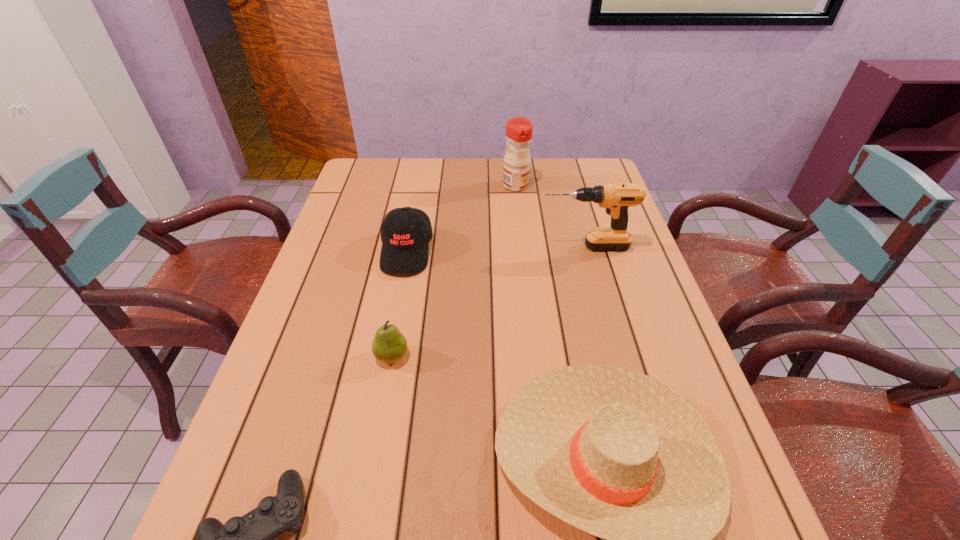
The image size is (960, 540). I want to click on the farthest object, so click(516, 169).

Find the location of `drill`. drill is located at coordinates (616, 198).

Find the location of `baseball cap`. baseball cap is located at coordinates (406, 232).

You are a GUI agent. You are given a task and a screenshot of the screen. Output one action in this format:
    pyautogui.click(x=<x>, y=<y>)
    Task: Click on the fourth farthest object
    The image size is (960, 540).
    Given the screenshot: What is the action you would take?
    [389, 345]

Find the location of a particular element. free space located on the right of the condiment is located at coordinates (577, 186).

Where is `free space located 0.090m at the tip of the drill`? Image resolution: width=960 pixels, height=540 pixels. free space located 0.090m at the tip of the drill is located at coordinates [507, 247].

What are the coordinates of `free region located 0.190m at the tip of the drill` in the screenshot? It's located at (470, 247).

The height and width of the screenshot is (540, 960). Identify the location of free space located 0.280m at the tip of the drill. (439, 247).

Locate an element on the screen. The width and height of the screenshot is (960, 540). free region located 0.260m on the front-facing side of the baseball cap is located at coordinates (386, 361).

Locate an element on the screen. Image resolution: width=960 pixels, height=540 pixels. vacant space located on the back of the fourth farthest object is located at coordinates (405, 284).